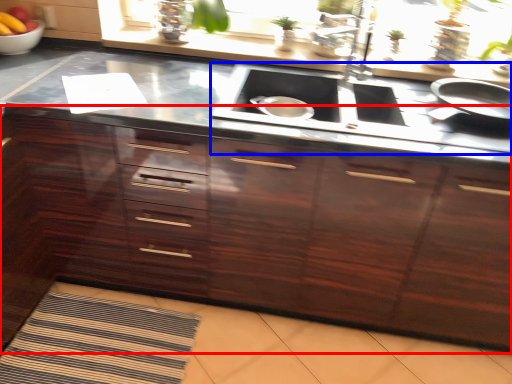
Question: Which object appears closest to the camera in this image, cabinetry (highlighted by a red box) or stove (highlighted by a blue box)?

Choices:
 (A) cabinetry
 (B) stove

Answer: (A)